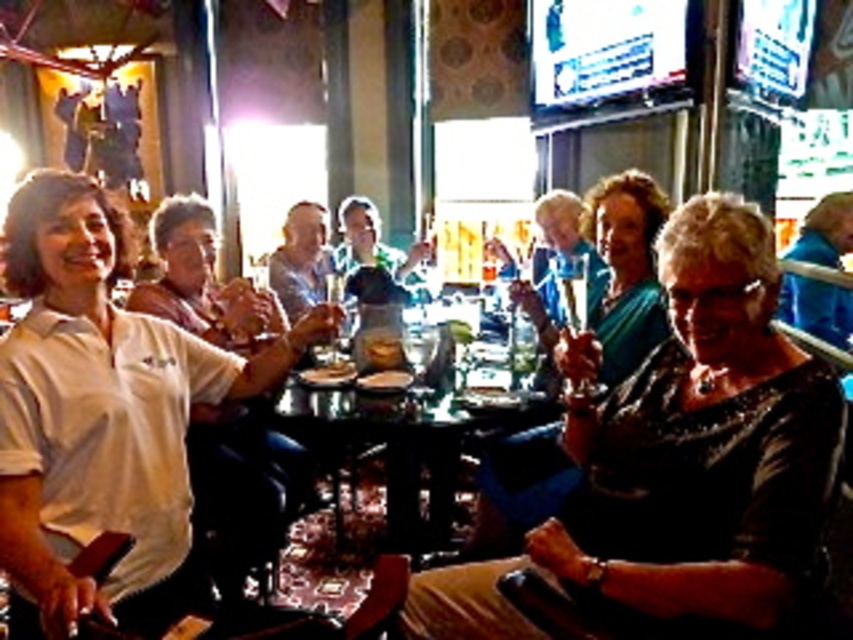
Based on the photo, is black sequined dress at center to the right of glassy wooden table at center from the viewer's perspective?

Yes, black sequined dress at center is to the right of glassy wooden table at center.

Which is more to the left, black sequined dress at center or glassy wooden table at center?

Positioned to the left is glassy wooden table at center.

Who is more distant from viewer, (701, 200) or (442, 493)?

Positioned behind is point (442, 493).

What are the coordinates of `black sequined dress at center` in the screenshot? It's located at (672, 467).

Is the position of smooth blue shirt at center more distant than that of green fabric shirt at center?

No, it is in front of green fabric shirt at center.

Which is behind, point (320, 259) or point (351, 211)?

Point (351, 211)

At what (x,y) coordinates should I click in order to perform the action: click on smooth blue shirt at center. Please return your answer as a coordinate pair (x, y). This screenshot has width=853, height=640. Looking at the image, I should click on (300, 259).

Which of these two, white matte shirt at left or dark green fabric dress at center, stands shorter?

With less height is white matte shirt at left.

Can you confirm if white matte shirt at left is taller than dark green fabric dress at center?

In fact, white matte shirt at left may be shorter than dark green fabric dress at center.

Identify the location of white matte shirt at left. (103, 413).